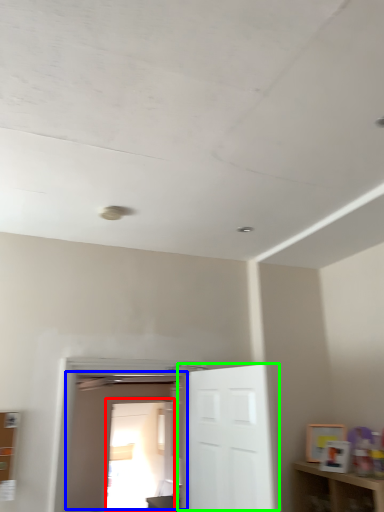
Question: Which object is positioned closest to glass door (highlighted by a red box)? Select from door (highlighted by a blue box) and door (highlighted by a green box).

Choices:
 (A) door
 (B) door

Answer: (A)